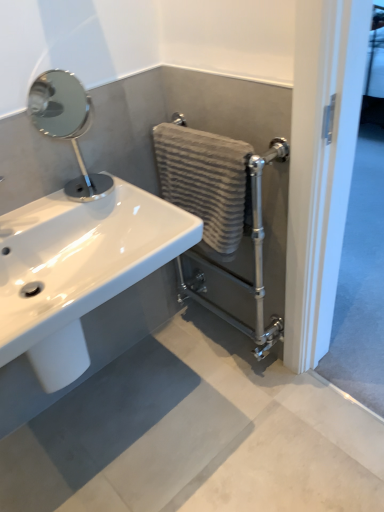
Question: Considering the positions of textured beige towel at center-right and matte gray concrete at lower center in the image, is textured beige towel at center-right wider or thinner than matte gray concrete at lower center?

Choices:
 (A) wide
 (B) thin

Answer: (B)

Question: Relative to matte gray concrete at lower center, is textured beige towel at center-right in front or behind?

Choices:
 (A) front
 (B) behind

Answer: (B)

Question: Which object is the closest to the white glossy sink at lower left?

Choices:
 (A) polished chrome mirror at upper left
 (B) textured beige towel at center-right
 (C) matte gray concrete at lower center

Answer: (B)

Question: Estimate the real-world distances between objects in this image. Which object is farther from the textured beige towel at center-right?

Choices:
 (A) matte gray concrete at lower center
 (B) white glossy sink at lower left
 (C) polished chrome mirror at upper left

Answer: (A)